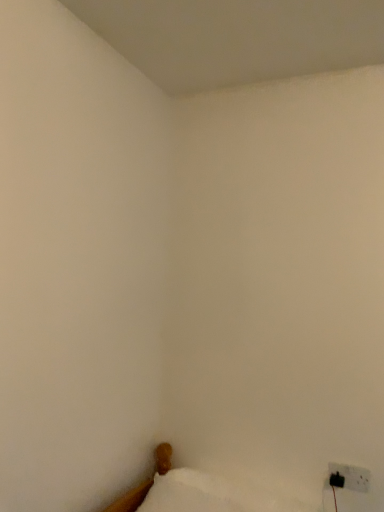
Image resolution: width=384 pixels, height=512 pixels. Describe the element at coordinates (196, 492) in the screenshot. I see `white fabric bed at lower right` at that location.

Identify the location of white fabric bed at lower right. (196, 492).

What do you see at coordinates (349, 477) in the screenshot? The image size is (384, 512). I see `black plastic electric outlet at lower right` at bounding box center [349, 477].

This screenshot has height=512, width=384. Identify the location of white soft pillow at lower left. (189, 493).

Considering the points (102, 510) and (356, 480), which point is in front, point (102, 510) or point (356, 480)?

The point (102, 510) is closer.

Find the location of a particular element. The height and width of the screenshot is (512, 384). furniture lying on the left of black plastic electric outlet at lower right is located at coordinates (196, 492).

From the image's perspective, relative to black plastic electric outlet at lower right, is white fabric bed at lower right above or below?

From the image's perspective, white fabric bed at lower right appears below black plastic electric outlet at lower right.

Considering the sizes of objects white fabric bed at lower right and black plastic electric outlet at lower right in the image provided, who is smaller, white fabric bed at lower right or black plastic electric outlet at lower right?

black plastic electric outlet at lower right is smaller.

Is white soft pillow at lower left located outside white fabric bed at lower right?

Yes.

Is point (200, 510) closer to camera compared to point (183, 480)?

Yes, it is.

Is white soft pillow at lower left oriented towards white fabric bed at lower right?

No, white soft pillow at lower left is not aimed at white fabric bed at lower right.

Which of these two, white soft pillow at lower left or white fabric bed at lower right, is smaller?

With smaller size is white fabric bed at lower right.

Based on the photo, considering the relative sizes of black plastic electric outlet at lower right and white fabric bed at lower right in the image provided, is black plastic electric outlet at lower right wider than white fabric bed at lower right?

No.

Does black plastic electric outlet at lower right turn towards white fabric bed at lower right?

No, black plastic electric outlet at lower right is not facing towards white fabric bed at lower right.

Consider the image. Is black plastic electric outlet at lower right placed right next to white fabric bed at lower right?

black plastic electric outlet at lower right and white fabric bed at lower right are not in contact.

Does black plastic electric outlet at lower right have a greater height compared to white fabric bed at lower right?

No.

Looking at their sizes, would you say white soft pillow at lower left is wider or thinner than black plastic electric outlet at lower right?

Clearly, white soft pillow at lower left has more width compared to black plastic electric outlet at lower right.

Can you confirm if white soft pillow at lower left is shorter than black plastic electric outlet at lower right?

Incorrect, the height of white soft pillow at lower left does not fall short of that of black plastic electric outlet at lower right.

Consider the image. Would you say black plastic electric outlet at lower right is part of white soft pillow at lower left's contents?

No, white soft pillow at lower left does not contain black plastic electric outlet at lower right.

From the image's perspective, is black plastic electric outlet at lower right on top of white soft pillow at lower left?

Yes, from the image's perspective, black plastic electric outlet at lower right is above white soft pillow at lower left.

Who is more distant, black plastic electric outlet at lower right or white soft pillow at lower left?

Positioned behind is black plastic electric outlet at lower right.

From a real-world perspective, is black plastic electric outlet at lower right located beneath white soft pillow at lower left?

Actually, black plastic electric outlet at lower right is physically above white soft pillow at lower left in the real world.

Is black plastic electric outlet at lower right far away from white soft pillow at lower left?

black plastic electric outlet at lower right is near white soft pillow at lower left, not far away.

What are the coordinates of `pillow lying on the left of white fabric bed at lower right` in the screenshot? It's located at (189, 493).

Does white fabric bed at lower right come in front of white soft pillow at lower left?

No, the depth of white fabric bed at lower right is greater than that of white soft pillow at lower left.

Is white fabric bed at lower right to the right of white soft pillow at lower left from the viewer's perspective?

Yes.

Is point (189, 470) positioned in front of point (212, 511)?

No, it is behind (212, 511).

This screenshot has width=384, height=512. I want to click on electric outlet behind the white fabric bed at lower right, so click(x=349, y=477).

This screenshot has width=384, height=512. What are the coordinates of `furniture that is on the right side of white soft pillow at lower left` in the screenshot? It's located at click(196, 492).

Estimate the real-world distances between objects in this image. Which object is further from black plastic electric outlet at lower right, white fabric bed at lower right or white soft pillow at lower left?

Among the two, white soft pillow at lower left is located further to black plastic electric outlet at lower right.

From the image, which object appears to be nearer to black plastic electric outlet at lower right, white soft pillow at lower left or white fabric bed at lower right?

Based on the image, white fabric bed at lower right appears to be nearer to black plastic electric outlet at lower right.

From the image, which object appears to be nearer to white fabric bed at lower right, black plastic electric outlet at lower right or white soft pillow at lower left?

white soft pillow at lower left.

Based on their spatial positions, is white soft pillow at lower left or black plastic electric outlet at lower right closer to white fabric bed at lower right?

white soft pillow at lower left is positioned closer to the anchor white fabric bed at lower right.

Which object lies further to the anchor point white soft pillow at lower left, white fabric bed at lower right or black plastic electric outlet at lower right?

Among the two, black plastic electric outlet at lower right is located further to white soft pillow at lower left.

Estimate the real-world distances between objects in this image. Which object is closer to white soft pillow at lower left, black plastic electric outlet at lower right or white fabric bed at lower right?

white fabric bed at lower right is closer to white soft pillow at lower left.

This screenshot has width=384, height=512. I want to click on furniture located between white soft pillow at lower left and black plastic electric outlet at lower right in the left-right direction, so click(196, 492).